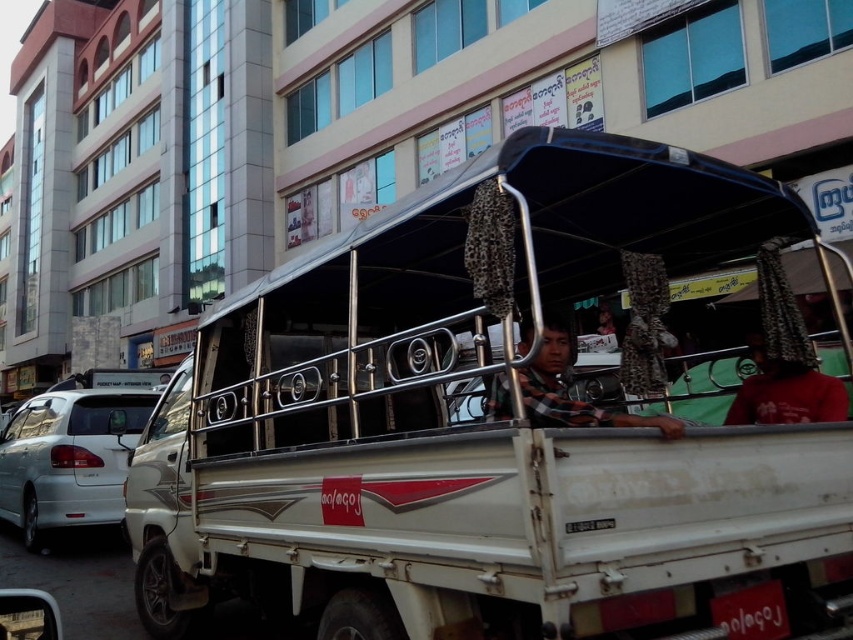
You are standing on the sidewalk and want to cross the street to reach the white matte truck at center. The crosswalk is 5 feet away from you. Can you safely reach the truck before the crosswalk ends?

The white matte truck at center is 3.64 feet away from you, which is less than the 5 feet distance to the crosswalk. Therefore, you can safely reach the truck before the crosswalk ends.

You are a passenger in the white pickup truck and want to move from the point at coordinates point (x=206, y=538) to the point at coordinates point (x=759, y=628). Which direction should you move in relation to the truck?

You should move towards the front of the truck because point (x=206, y=538) is behind point (x=759, y=628).